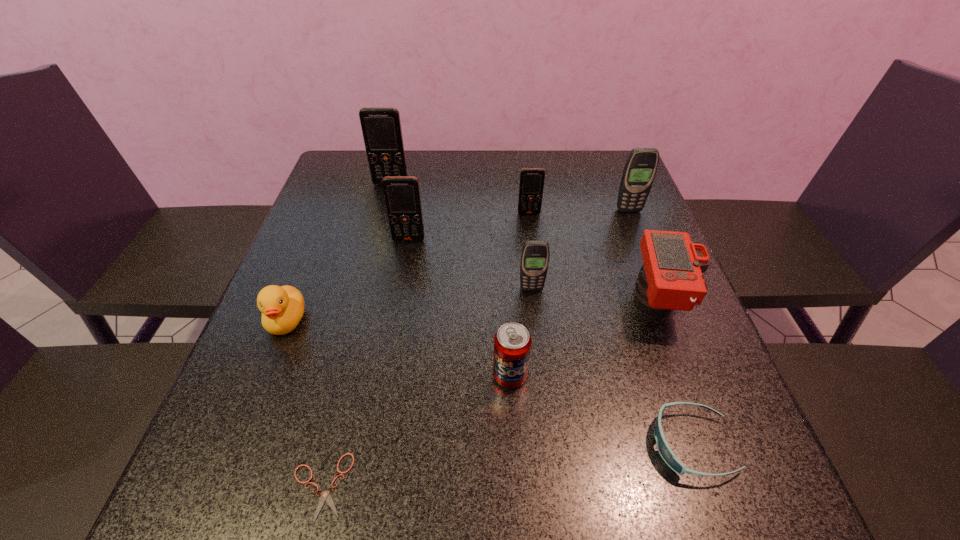
This screenshot has width=960, height=540. I want to click on goggles present at the near edge, so click(x=668, y=456).

Locate an element on the screen. The height and width of the screenshot is (540, 960). shears that is at the near edge is located at coordinates (325, 496).

At what (x,y) coordinates should I click in order to perform the action: click on cellular telephone present at the left edge. Please return your answer as a coordinate pair (x, y). Looking at the image, I should click on (381, 126).

This screenshot has height=540, width=960. I want to click on duck at the left edge, so click(282, 308).

Where is `shears present at the left edge`? Image resolution: width=960 pixels, height=540 pixels. shears present at the left edge is located at coordinates (325, 496).

You are a GUI agent. You are given a task and a screenshot of the screen. Output one action in this format:
    pyautogui.click(x=<x>, y=<y>)
    Task: Click on the cellular telephone that is at the right edge
    
    Given the screenshot: What is the action you would take?
    pyautogui.click(x=640, y=168)

Find the location of a particular element. camera that is at the right edge is located at coordinates (671, 278).

The image size is (960, 540). I want to click on goggles that is at the right edge, so click(x=668, y=456).

Where is `object present at the far left corner`? The image size is (960, 540). object present at the far left corner is located at coordinates (381, 126).

Where is `object present at the near left corner`? The width and height of the screenshot is (960, 540). object present at the near left corner is located at coordinates (325, 496).